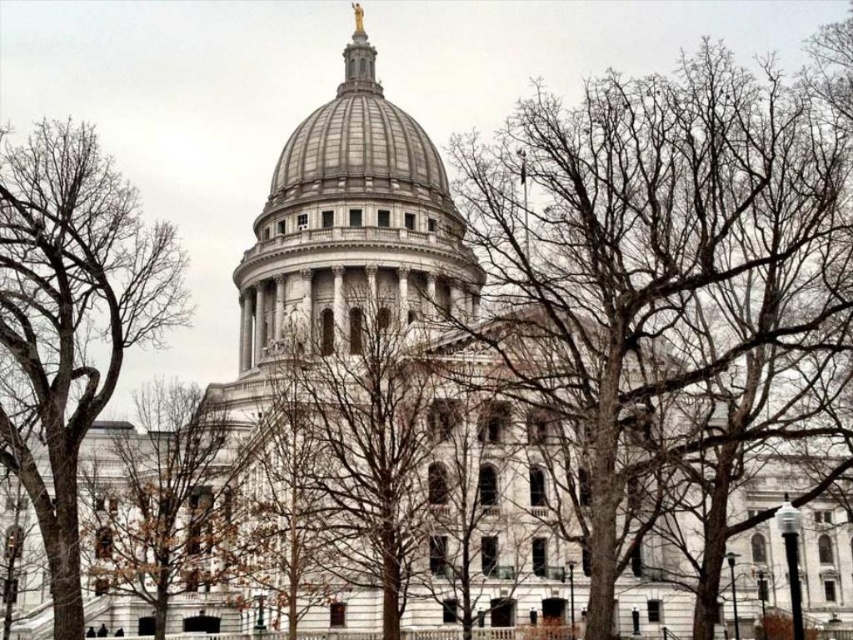
Who is more distant from viewer, [660,161] or [154,326]?

The point [154,326] is more distant.

Can you confirm if bare branches at center is positioned below bare branches at left?

No.

Describe the element at coordinates (659, 278) in the screenshot. I see `bare branches at center` at that location.

Where is `bare branches at center`? bare branches at center is located at coordinates (659, 278).

Does bare wood tree at center appear on the right side of brown leafless tree at lower left?

Indeed, bare wood tree at center is positioned on the right side of brown leafless tree at lower left.

Which of these two, bare wood tree at center or brown leafless tree at lower left, stands taller?

With more height is bare wood tree at center.

The height and width of the screenshot is (640, 853). Describe the element at coordinates (368, 452) in the screenshot. I see `bare wood tree at center` at that location.

Identify the location of bare wood tree at center. This screenshot has width=853, height=640. (368, 452).

Can you confirm if bare branches at center is thinner than bare wood tree at center?

No.

Describe the element at coordinates (659, 278) in the screenshot. I see `bare branches at center` at that location.

Identify the location of bare branches at center. The image size is (853, 640). (659, 278).